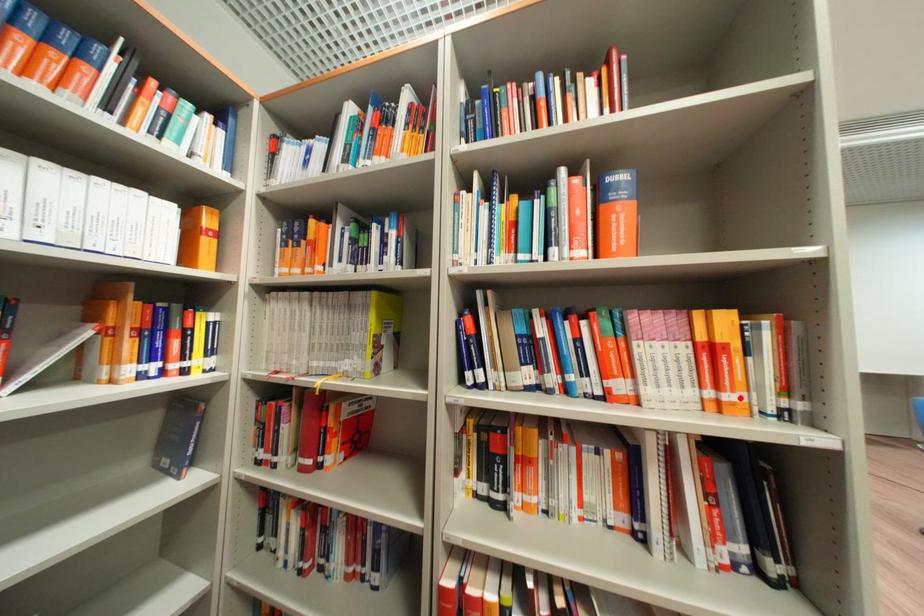
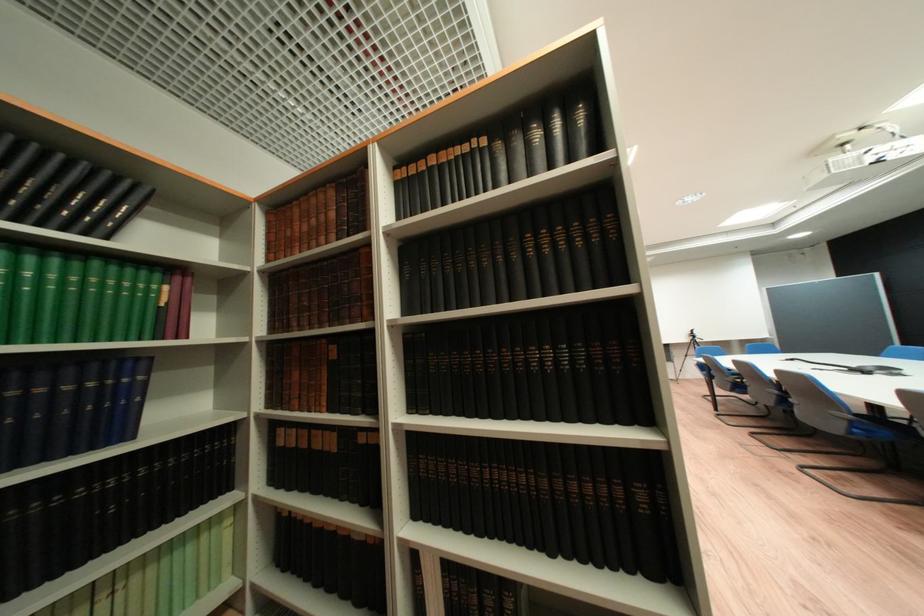
Question: I am providing you with two images of the same scene from different viewpoints. A red point is marked on the first image. At the location where the point appears in image 1, is it still visible in image 2?

Choices:
 (A) Yes
 (B) No

Answer: (B)